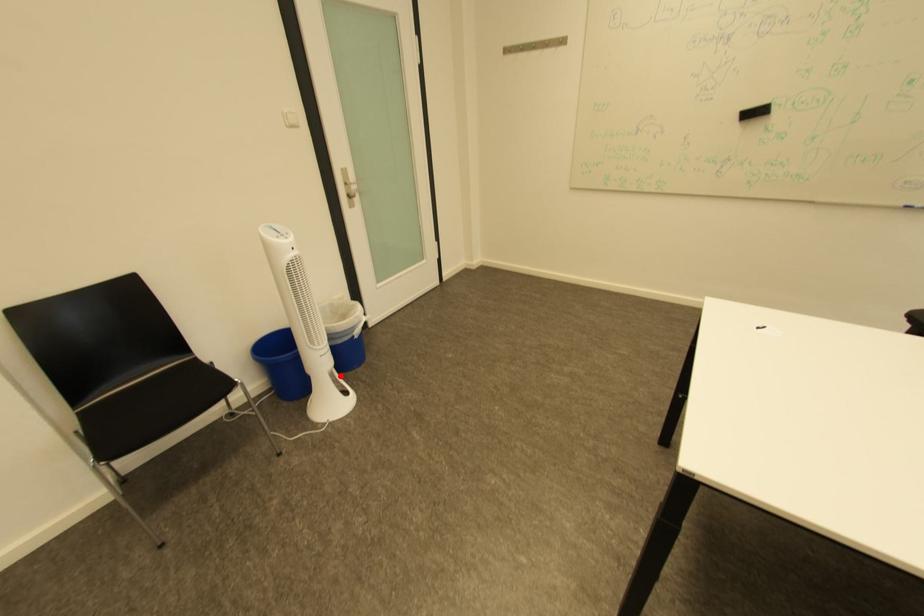
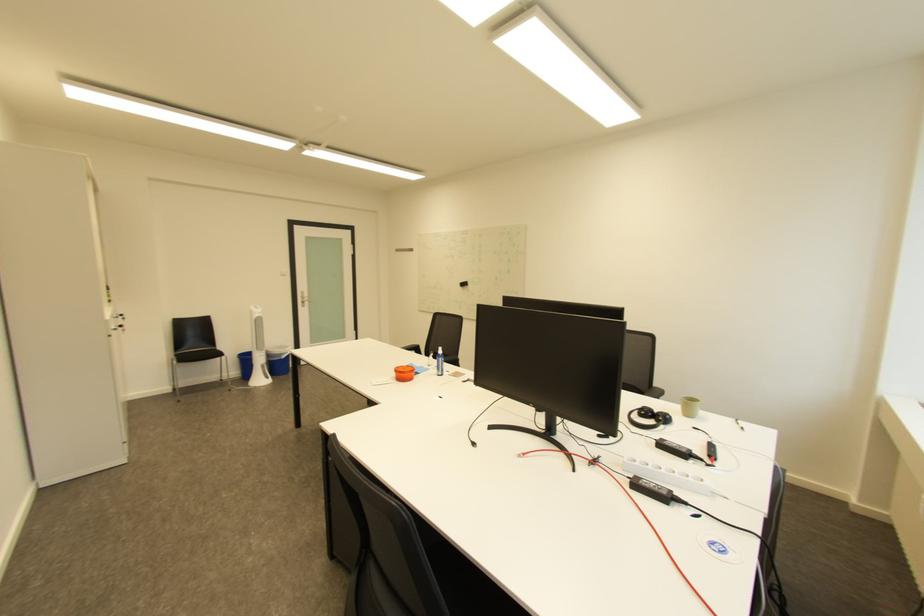
Question: I am providing you with two images of the same scene from different viewpoints. A red point is shown in image1. For the corresponding object point in image2, is it positioned nearer or farther from the camera?

Choices:
 (A) Nearer
 (B) Farther

Answer: (B)